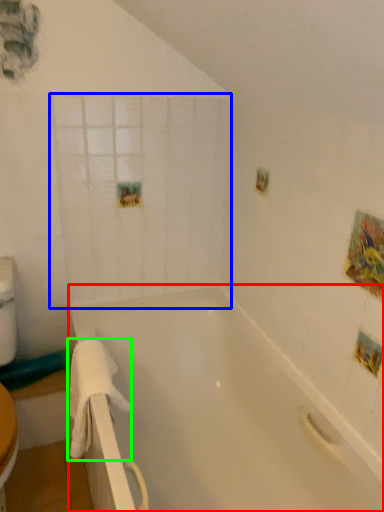
Question: Considering the real-world distances, which object is farthest from bathtub (highlighted by a red box)? glass door (highlighted by a blue box) or towel/napkin (highlighted by a green box)?

Choices:
 (A) glass door
 (B) towel/napkin

Answer: (A)